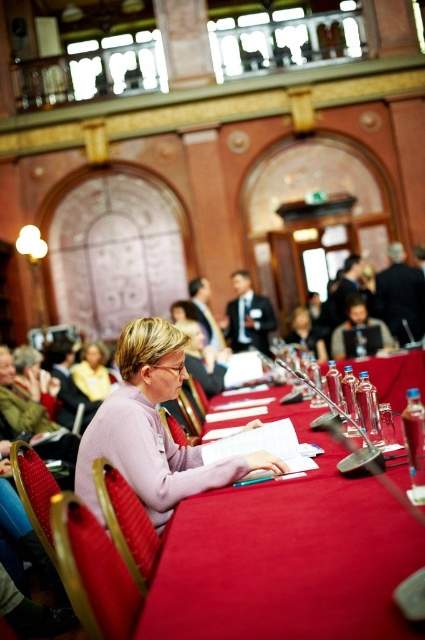
Between smooth red table at center and matte yellow shirt at lower left, which one has more height?

matte yellow shirt at lower left is taller.

Which is behind, point (365, 365) or point (90, 340)?

The point (90, 340) is behind.

Identify the location of smooth red table at center. This screenshot has height=640, width=425. (286, 557).

Does smooth red table at center have a lesser width compared to pink matte sweater at center?

Yes.

Measure the distance from smooth red table at center to pink matte sweater at center.

They are 28.17 inches apart.

Is point (396, 564) positioned after point (108, 454)?

No, it is not.

Locate an element on the screen. The image size is (425, 640). smooth red table at center is located at coordinates (286, 557).

Does pink matte sweater at center have a greater height compared to matte yellow shirt at lower left?

Correct, pink matte sweater at center is much taller as matte yellow shirt at lower left.

Which of these two, pink matte sweater at center or matte yellow shirt at lower left, stands taller?

pink matte sweater at center is taller.

You are a GUI agent. You are given a task and a screenshot of the screen. Output one action in this format:
    pyautogui.click(x=<x>, y=<y>)
    Task: Click on the pink matte sweater at center
    The width and height of the screenshot is (425, 640).
    Given the screenshot: What is the action you would take?
    pyautogui.click(x=153, y=428)